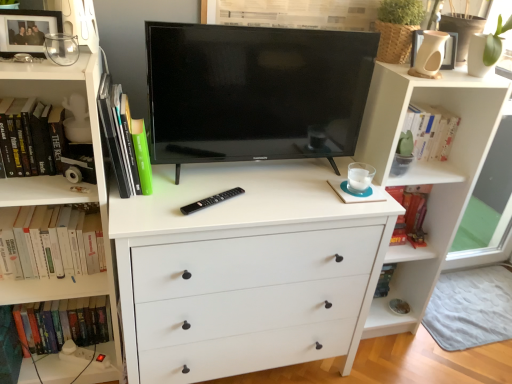
Image resolution: width=512 pixels, height=384 pixels. In order to click on vacant area that lies in front of black plastic remote control at center in this screenshot , I will do tap(199, 223).